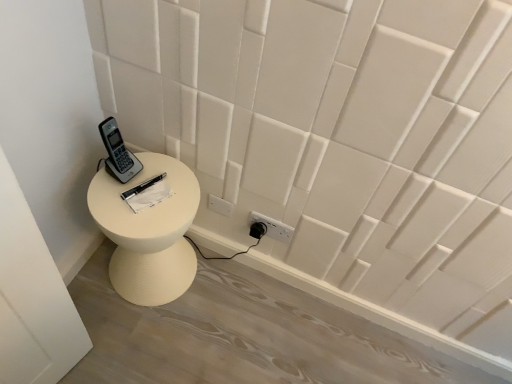
Question: Is white matte side table at lower left taller or shorter than gray plastic phone at upper left?

Choices:
 (A) tall
 (B) short

Answer: (A)

Question: From a real-world perspective, relative to gray plastic phone at upper left, is white matte side table at lower left vertically above or below?

Choices:
 (A) above
 (B) below

Answer: (B)

Question: Which object is the closest to the white matte side table at lower left?

Choices:
 (A) gray plastic phone at upper left
 (B) white paper at center

Answer: (B)

Question: Estimate the real-world distances between objects in this image. Which object is closer to the white paper at center?

Choices:
 (A) gray plastic phone at upper left
 (B) white matte side table at lower left

Answer: (A)